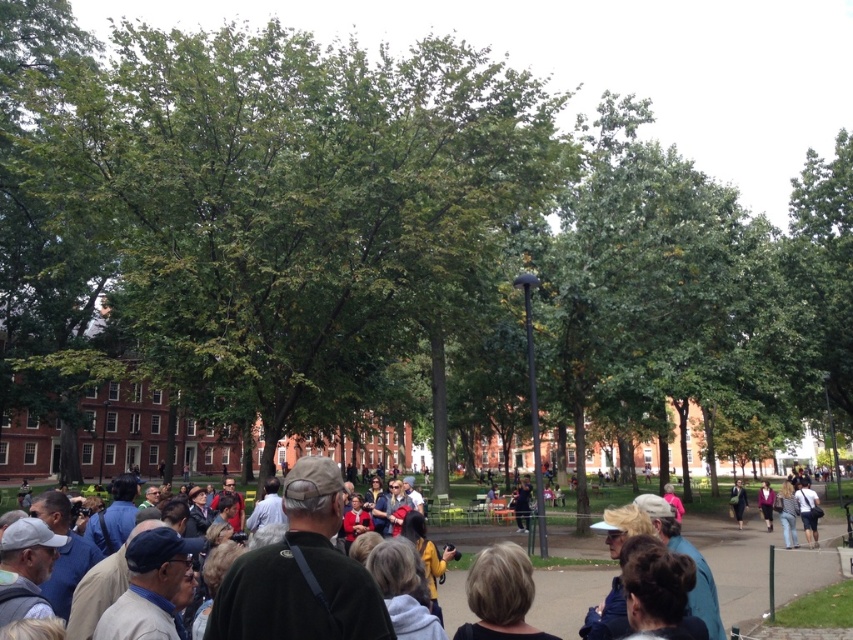
Is dark blue jeans at center above dark purple sweater at center?

Correct, dark blue jeans at center is located above dark purple sweater at center.

Who is shorter, dark blue jeans at center or dark purple sweater at center?

With less height is dark blue jeans at center.

Does point (813, 522) come closer to viewer compared to point (761, 509)?

Yes, it is.

Where is `dark blue jeans at center`? dark blue jeans at center is located at coordinates pyautogui.click(x=808, y=509).

Which of these two, jeans at right or dark purple sweater at center, stands shorter?

jeans at right is shorter.

Is jeans at right closer to camera compared to dark purple sweater at center?

That is True.

Who is more forward, (790,536) or (770,524)?

Positioned in front is point (790,536).

The height and width of the screenshot is (640, 853). I want to click on jeans at right, so click(787, 513).

This screenshot has height=640, width=853. What do you see at coordinates (500, 595) in the screenshot? I see `blonde hair at center` at bounding box center [500, 595].

Between blonde hair at center and dark purple sweater at center, which one has less height?

dark purple sweater at center is shorter.

Locate an element on the screen. blonde hair at center is located at coordinates (500, 595).